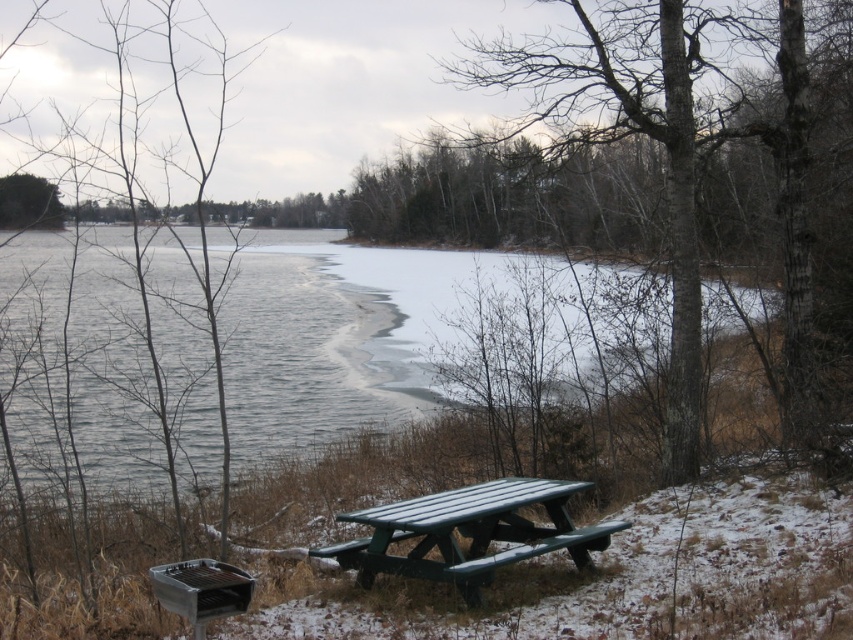
Question: Is smooth bark tree at center to the left of smooth metal grill at lower left from the viewer's perspective?

Choices:
 (A) yes
 (B) no

Answer: (B)

Question: Which point is closer to the camera?

Choices:
 (A) (12, 202)
 (B) (163, 13)

Answer: (A)

Question: Which point is farther to the camera?

Choices:
 (A) (45, 209)
 (B) (682, 44)

Answer: (A)

Question: Can you confirm if smooth bark tree at center is positioned to the right of green leafy tree at upper left?

Choices:
 (A) no
 (B) yes

Answer: (B)

Question: Can you confirm if smooth bark tree at center is positioned to the right of green plastic picnic table at center?

Choices:
 (A) yes
 (B) no

Answer: (A)

Question: Among these points, which one is nearest to the camera?

Choices:
 (A) (196, 36)
 (B) (604, 524)
 (C) (633, 51)

Answer: (B)